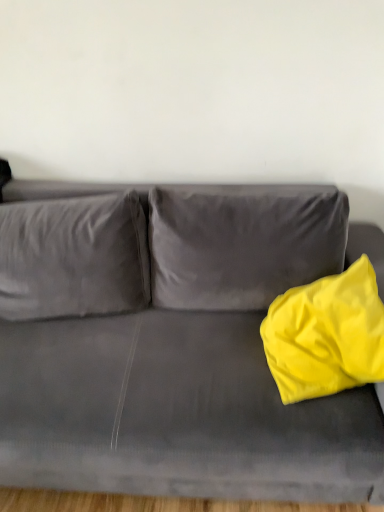
The height and width of the screenshot is (512, 384). Identify the location of yellow fabric pillow at right. (326, 335).

The image size is (384, 512). What do you see at coordinates (326, 335) in the screenshot? I see `yellow fabric pillow at right` at bounding box center [326, 335].

Image resolution: width=384 pixels, height=512 pixels. What do you see at coordinates (179, 352) in the screenshot?
I see `matte gray couch at center` at bounding box center [179, 352].

At what (x,y) coordinates should I click in order to perform the action: click on matte gray couch at center. Please return your answer as a coordinate pair (x, y). The image size is (384, 512). Looking at the image, I should click on (179, 352).

Locate an element on the screen. The width and height of the screenshot is (384, 512). yellow fabric pillow at right is located at coordinates (326, 335).

Does matte gray couch at center appear on the right side of yellow fabric pillow at right?

No.

Is matte gray couch at center positioned in front of yellow fabric pillow at right?

Yes, matte gray couch at center is in front of yellow fabric pillow at right.

Does point (60, 350) come behind point (335, 286)?

That is True.

From the image's perspective, does matte gray couch at center appear lower than yellow fabric pillow at right?

Yes.

From a real-world perspective, is matte gray couch at center physically below yellow fabric pillow at right?

Correct, in the physical world, matte gray couch at center is lower than yellow fabric pillow at right.

Which of these two, matte gray couch at center or yellow fabric pillow at right, is wider?

Wider between the two is matte gray couch at center.

Can you confirm if matte gray couch at center is shorter than yellow fabric pillow at right?

No.

Based on their sizes in the image, would you say matte gray couch at center is bigger or smaller than yellow fabric pillow at right?

Considering their sizes, matte gray couch at center takes up more space than yellow fabric pillow at right.

Does matte gray couch at center contain yellow fabric pillow at right?

Indeed, yellow fabric pillow at right is located within matte gray couch at center.

Looking at this image, would you say matte gray couch at center is a long distance from yellow fabric pillow at right?

Actually, matte gray couch at center and yellow fabric pillow at right are a little close together.

Is matte gray couch at center facing towards yellow fabric pillow at right?

No, matte gray couch at center is not aimed at yellow fabric pillow at right.

This screenshot has height=512, width=384. Identify the location of throw pillow above the matte gray couch at center (from a real-world perspective). (326, 335).

Can you confirm if yellow fabric pillow at right is positioned to the left of matte gray couch at center?

Incorrect, yellow fabric pillow at right is not on the left side of matte gray couch at center.

Does yellow fabric pillow at right come behind matte gray couch at center?

That is True.

Is point (335, 308) positioned after point (363, 487)?

Yes.

From the image's perspective, which one is positioned higher, yellow fabric pillow at right or matte gray couch at center?

yellow fabric pillow at right, from the image's perspective.

From a real-world perspective, which object stands above the other?

In real-world perspective, yellow fabric pillow at right is above.

Considering the relative sizes of yellow fabric pillow at right and matte gray couch at center in the image provided, is yellow fabric pillow at right thinner than matte gray couch at center?

Yes.

Which of these two, yellow fabric pillow at right or matte gray couch at center, stands shorter?

With less height is yellow fabric pillow at right.

Considering the sizes of yellow fabric pillow at right and matte gray couch at center in the image, is yellow fabric pillow at right bigger or smaller than matte gray couch at center?

Considering their sizes, yellow fabric pillow at right takes up less space than matte gray couch at center.

Would you say yellow fabric pillow at right is outside matte gray couch at center?

No, yellow fabric pillow at right is inside or overlapping with matte gray couch at center.

Can you see yellow fabric pillow at right touching matte gray couch at center?

No, yellow fabric pillow at right is not next to matte gray couch at center.

Is yellow fabric pillow at right aimed at matte gray couch at center?

Yes.

This screenshot has height=512, width=384. Identify the location of throw pillow on the right side of matte gray couch at center. (326, 335).

You are a GUI agent. You are given a task and a screenshot of the screen. Output one action in this format:
    pyautogui.click(x=<x>, y=<y>)
    Task: Click on the throw pillow located on the right of matte gray couch at center
    The image size is (384, 512).
    Given the screenshot: What is the action you would take?
    coord(326,335)

The width and height of the screenshot is (384, 512). What are the coordinates of `studio couch to the left of yellow fabric pillow at right` in the screenshot? It's located at (179, 352).